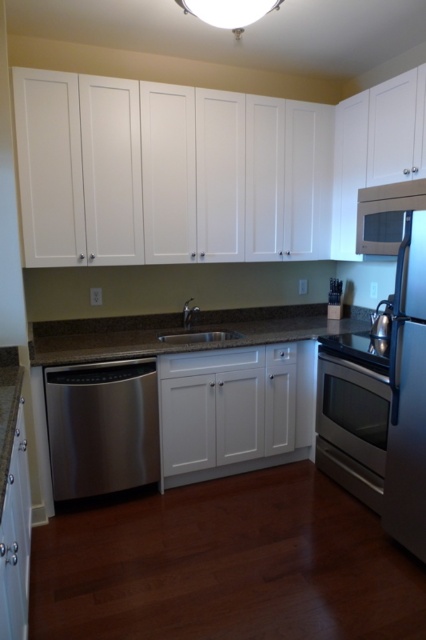
Which is more to the left, brown granite countertop at center or stainless steel sink at center?

Positioned to the left is stainless steel sink at center.

From the picture: Is brown granite countertop at center smaller than stainless steel sink at center?

No.

The image size is (426, 640). Find the location of `brown granite countertop at center`. brown granite countertop at center is located at coordinates (184, 332).

Does brown granite countertop at center have a greater width compared to stainless steel oven at lower center?

Correct, the width of brown granite countertop at center exceeds that of stainless steel oven at lower center.

Between brown granite countertop at center and stainless steel oven at lower center, which one has less height?

Standing shorter between the two is brown granite countertop at center.

I want to click on brown granite countertop at center, so click(x=184, y=332).

From the picture: Does stainless steel dishwasher at lower left lie behind satin nickel exhaust hood at upper right?

Yes, it is behind satin nickel exhaust hood at upper right.

You are a GUI agent. You are given a task and a screenshot of the screen. Output one action in this format:
    pyautogui.click(x=<x>, y=<y>)
    Task: Click on the stainless steel dishwasher at lower left
    
    Given the screenshot: What is the action you would take?
    pyautogui.click(x=101, y=426)

Does point (103, 420) come in front of point (359, 198)?

Yes, it is.

Image resolution: width=426 pixels, height=640 pixels. In order to click on stainless steel dishwasher at lower left in this screenshot , I will do `click(101, 426)`.